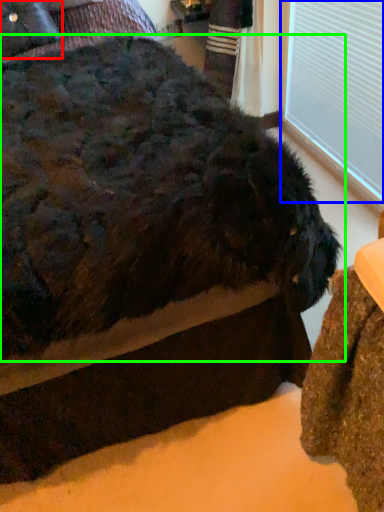
Question: Based on their relative distances, which object is nearer to pillow (highlighted by a red box)? Choose from window frame (highlighted by a blue box) and dog (highlighted by a green box).

Choices:
 (A) window frame
 (B) dog

Answer: (B)